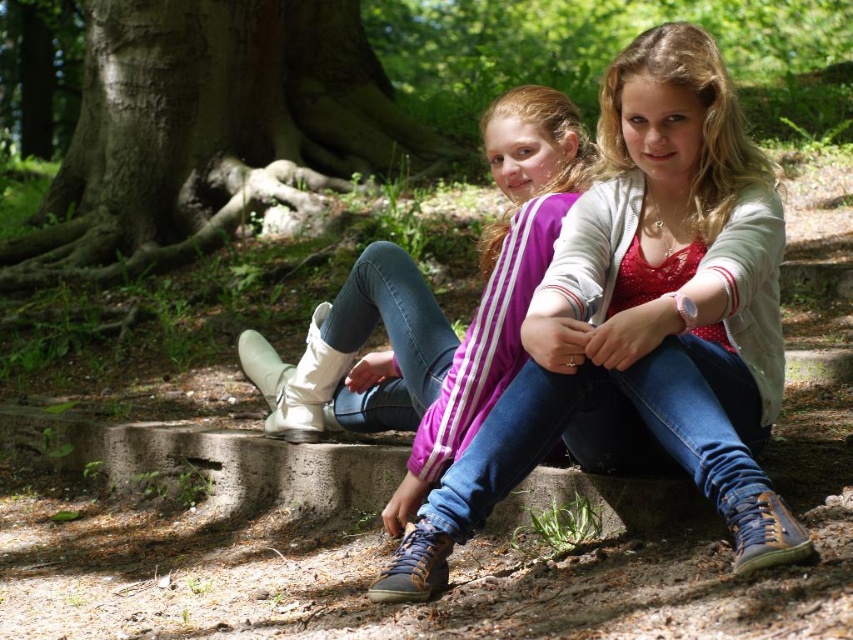
You are designing a new fashion catalog layout. You need to place both the denim jeans at center and the matte white boots at center in a photo shoot. Based on their sizes in the current image, which item should be placed closer to the foreground to maintain visual balance?

The denim jeans at center occupies less space than the matte white boots at center, so to maintain visual balance, the denim jeans at center should be placed closer to the foreground since smaller items are typically positioned closer to create balance with larger items.

You are a photographer trying to capture a photo of the denim jeans at center and the smooth brown tree trunk at center. Which object should you focus on first if you want to include both in your frame without moving the camera?

The denim jeans at center is smaller than the smooth brown tree trunk at center, so you should focus on the denim jeans at center first to ensure it fits within the frame while still capturing the larger tree trunk.